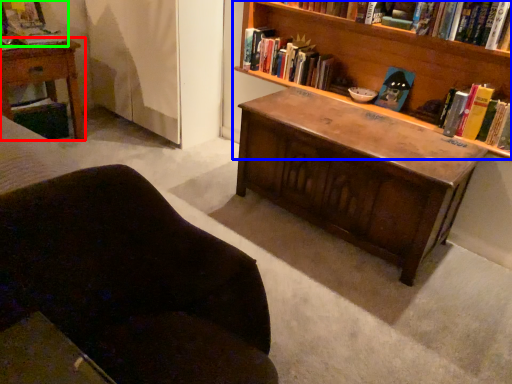
Question: Estimate the real-world distances between objects in this image. Which object is farther from nightstand (highlighted by a red box), bookcase (highlighted by a blue box) or book (highlighted by a green box)?

Choices:
 (A) bookcase
 (B) book

Answer: (A)